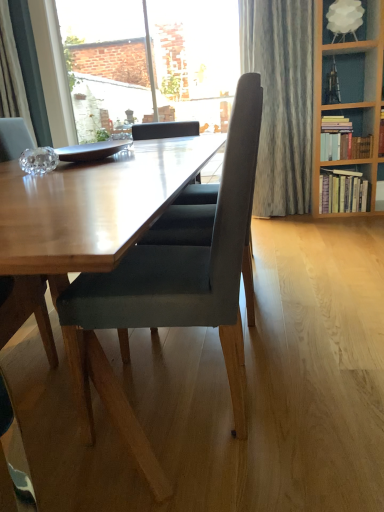
Where is `free spot to the left of hardcover books at right, which is counted as the first book, starting from the bottom`? free spot to the left of hardcover books at right, which is counted as the first book, starting from the bottom is located at coordinates click(x=300, y=219).